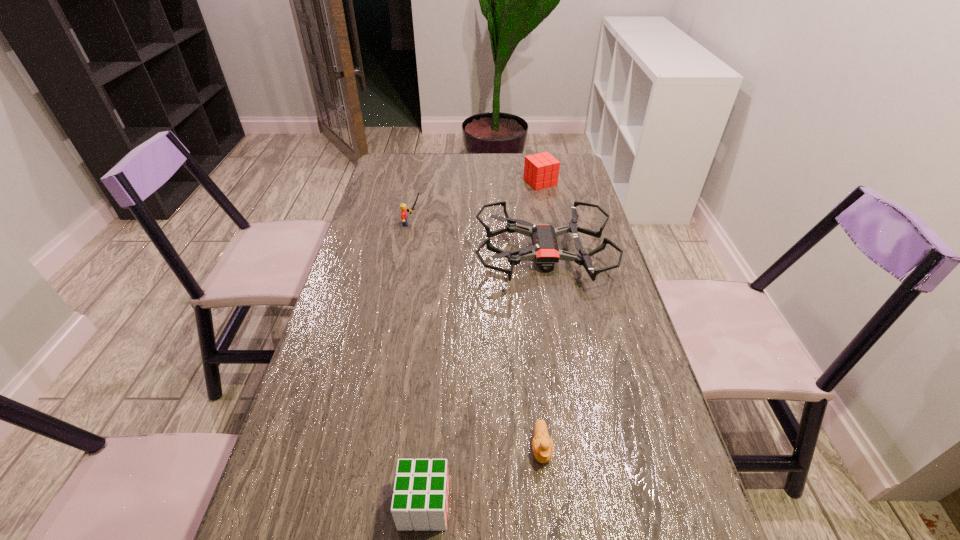
Where is `vacant region between the left cube and the leftmost object`? The width and height of the screenshot is (960, 540). vacant region between the left cube and the leftmost object is located at coordinates (419, 364).

This screenshot has width=960, height=540. What are the coordinates of `empty location between the second nearest object and the Lego` in the screenshot? It's located at (477, 336).

At what (x,y) coordinates should I click in order to perform the action: click on free area in between the Lego and the drone. Please return your answer as a coordinate pair (x, y). Looking at the image, I should click on (478, 240).

Select which object appears as the third closest to the drone. Please provide its 2D coordinates. Your answer should be formatted as a tuple, i.e. [(x, y)], where the tuple contains the x and y coordinates of a point satisfying the conditions above.

[(543, 447)]

Where is `object that ranks as the fourth closest to the nearest object`? object that ranks as the fourth closest to the nearest object is located at coordinates (541, 170).

The height and width of the screenshot is (540, 960). I want to click on free spot that satisfies the following two spatial constraints: 1. on the front side of the farther cube; 2. on the front-facing side of the leftmost object, so click(548, 224).

You are a GUI agent. You are given a task and a screenshot of the screen. Output one action in this format:
    pyautogui.click(x=<x>, y=<y>)
    Task: Click on the free point that satisfies the following two spatial constraints: 1. on the front side of the right cube; 2. with the camera facing forward on the drone
    The image size is (960, 540).
    Given the screenshot: What is the action you would take?
    pyautogui.click(x=555, y=255)